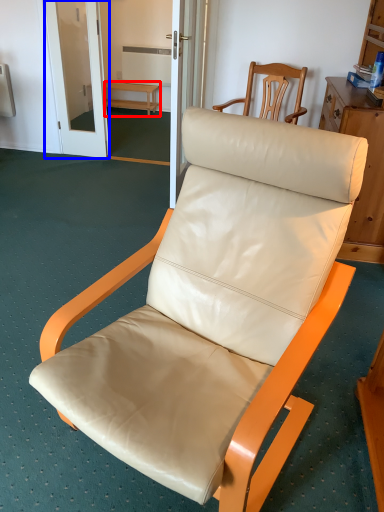
Question: Which object appears farthest to the camera in this image, furniture (highlighted by a red box) or screen door (highlighted by a blue box)?

Choices:
 (A) furniture
 (B) screen door

Answer: (A)